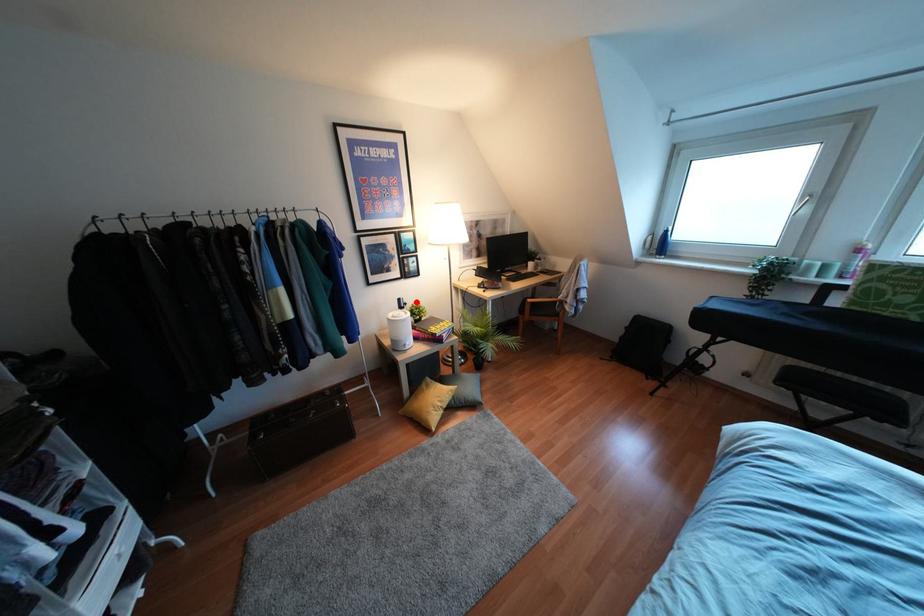
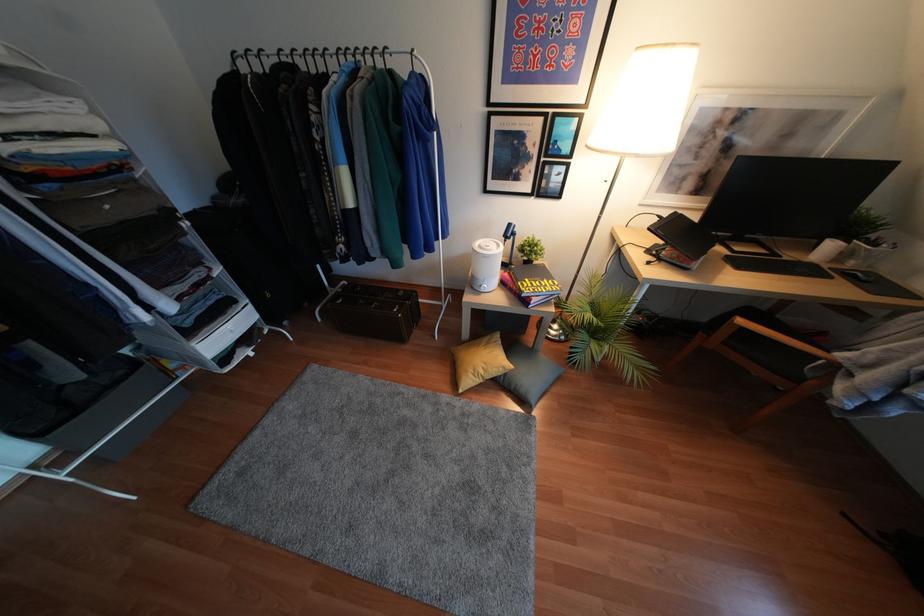
Question: I am providing you with two images of the same scene from different viewpoints. Image1 has a red point marked. In image2, the corresponding 3D location appears at what relative position? Reply with the corresponding letter.

Choices:
 (A) Closer
 (B) Farther

Answer: (A)